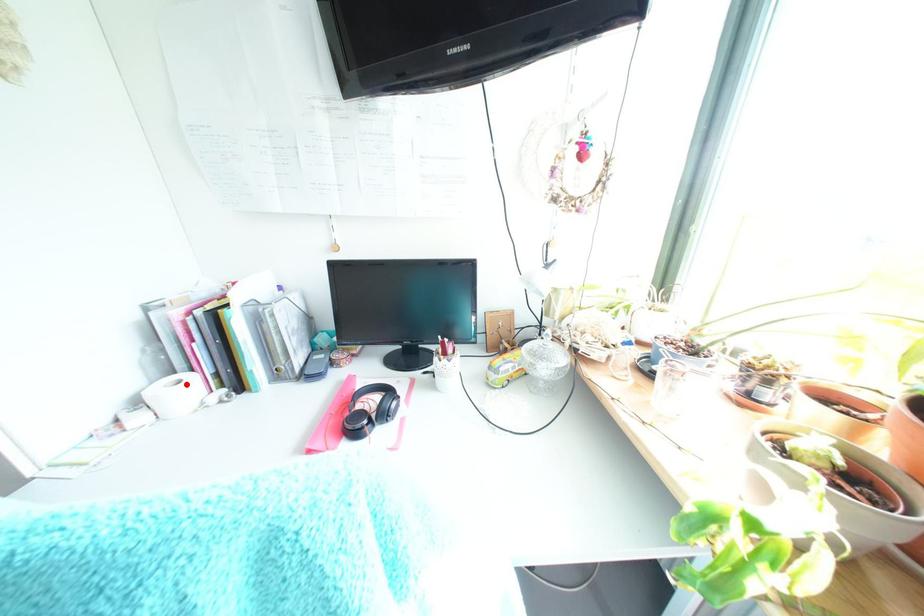
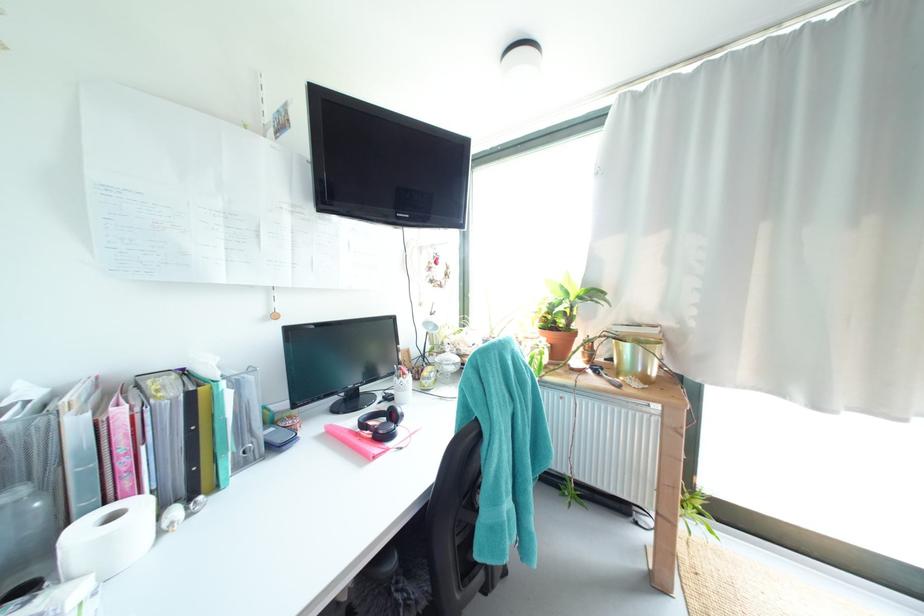
Question: I am providing you with two images of the same scene from different viewpoints. A red point is marked on the first image. Is the red point's position out of view in image 2?

Choices:
 (A) Yes
 (B) No

Answer: (B)